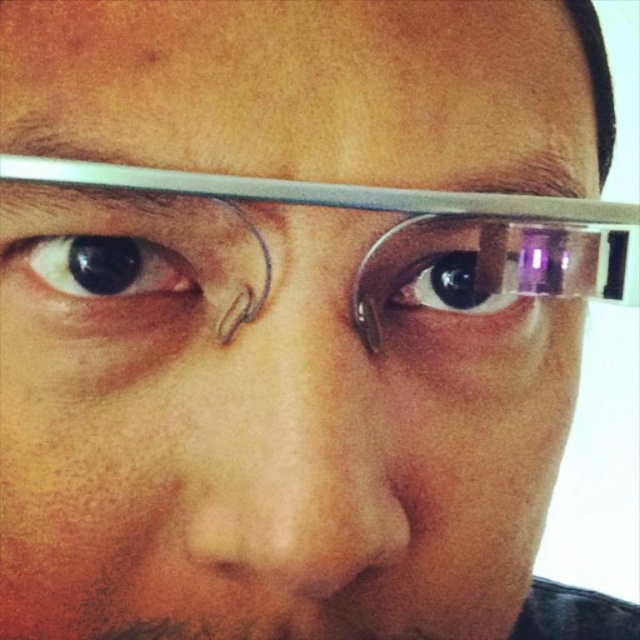
Is black glossy eye at left below clear glass eye at center?

No, black glossy eye at left is not below clear glass eye at center.

Can you confirm if black glossy eye at left is taller than clear glass eye at center?

In fact, black glossy eye at left may be shorter than clear glass eye at center.

Does point (172, 294) lie behind point (468, 280)?

No.

This screenshot has height=640, width=640. In order to click on black glossy eye at left in this screenshot , I will do `click(106, 268)`.

Can you confirm if smooth skin nose at center is shorter than clear plastic glasses at upper center?

In fact, smooth skin nose at center may be taller than clear plastic glasses at upper center.

Is smooth skin nose at center further to camera compared to clear plastic glasses at upper center?

No, it is in front of clear plastic glasses at upper center.

Which is in front, point (264, 476) or point (497, 209)?

Point (264, 476)

Locate an element on the screen. This screenshot has height=640, width=640. smooth skin nose at center is located at coordinates (291, 452).

Is point (321, 284) positioned before point (132, 269)?

Yes, point (321, 284) is in front of point (132, 269).

Can you confirm if smooth skin nose at center is smaller than black glossy eye at left?

Incorrect, smooth skin nose at center is not smaller in size than black glossy eye at left.

The image size is (640, 640). I want to click on smooth skin nose at center, so click(x=291, y=452).